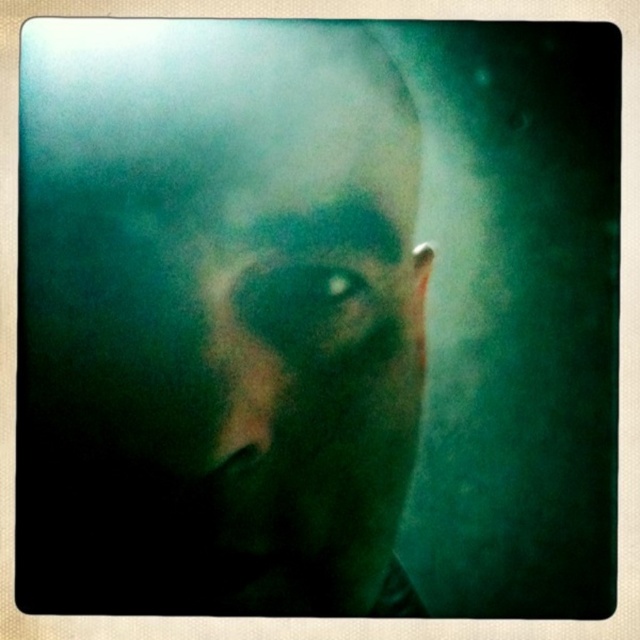
Who is lower down, matte green face at center or smokey green eye at center?

smokey green eye at center is below.

Which is above, matte green face at center or smokey green eye at center?

matte green face at center

This screenshot has height=640, width=640. What are the coordinates of `matte green face at center` in the screenshot? It's located at (230, 289).

Locate an element on the screen. matte green face at center is located at coordinates (230, 289).